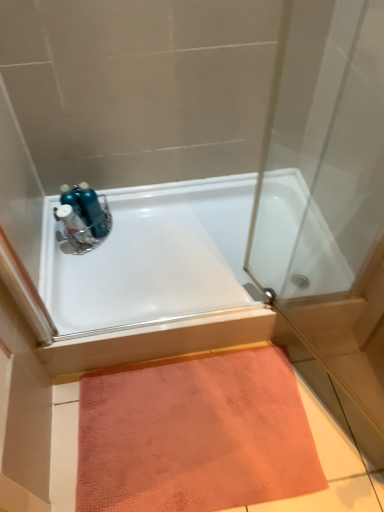
Describe the element at coordinates (152, 257) in the screenshot. The height and width of the screenshot is (512, 384). I see `white glossy bathtub at upper center` at that location.

This screenshot has height=512, width=384. Find the location of `white glossy bathtub at upper center`. white glossy bathtub at upper center is located at coordinates (152, 257).

Measure the distance between point (115, 487) and camera.

Point (115, 487) is 4.33 feet from camera.

What do you see at coordinates (91, 210) in the screenshot? I see `blue metallic bottles at upper left` at bounding box center [91, 210].

Find the location of `blue metallic bottles at upper left`. blue metallic bottles at upper left is located at coordinates (91, 210).

Locate an element on the screen. This screenshot has width=384, height=512. white glossy bathtub at upper center is located at coordinates (152, 257).

From the image's perspective, is metallic blue sink at upper left above white glossy bathtub at upper center?

Yes, from the image's perspective, metallic blue sink at upper left is above white glossy bathtub at upper center.

You are a GUI agent. You are given a task and a screenshot of the screen. Output one action in this format:
    pyautogui.click(x=<x>, y=<y>)
    Task: Click on the bathtub below the metallic blue sink at upper left (from the image's perspective)
    
    Given the screenshot: What is the action you would take?
    pyautogui.click(x=152, y=257)

Considering the relative sizes of metallic blue sink at upper left and white glossy bathtub at upper center in the image provided, is metallic blue sink at upper left thinner than white glossy bathtub at upper center?

Yes.

Which point is more forward, (106, 200) or (191, 228)?

The point (191, 228) is closer to the camera.

Is white glossy bathtub at upper center not inside metallic blue sink at upper left?

white glossy bathtub at upper center lies outside metallic blue sink at upper left's area.

What are the coordinates of `sink on the left of white glossy bathtub at upper center` in the screenshot? It's located at (83, 217).

How many degrees apart are the facing directions of white glossy bathtub at upper center and metallic blue sink at upper left?

There is a 1.5-degree angle between the facing directions of white glossy bathtub at upper center and metallic blue sink at upper left.

From a real-world perspective, is white glossy bathtub at upper center located beneath metallic blue sink at upper left?

Yes, from a real-world perspective, white glossy bathtub at upper center is beneath metallic blue sink at upper left.

From a real-world perspective, is white glossy bathtub at upper center physically located above or below orange textured mat at lower center?

Clearly, from a real-world perspective, white glossy bathtub at upper center is above orange textured mat at lower center.

Is white glossy bathtub at upper center thinner than orange textured mat at lower center?

No.

Between white glossy bathtub at upper center and orange textured mat at lower center, which one appears on the right side from the viewer's perspective?

Positioned to the right is orange textured mat at lower center.

From the image's perspective, is blue metallic bottles at upper left positioned above or below orange textured mat at lower center?

From the image's perspective, blue metallic bottles at upper left appears above orange textured mat at lower center.

Is blue metallic bottles at upper left turned away from orange textured mat at lower center?

No, blue metallic bottles at upper left's orientation is not away from orange textured mat at lower center.

Between blue metallic bottles at upper left and orange textured mat at lower center, which one appears on the left side from the viewer's perspective?

blue metallic bottles at upper left.

From a real-world perspective, which object stands above the other?

blue metallic bottles at upper left.

Considering the sizes of objects orange textured mat at lower center and metallic blue sink at upper left in the image provided, who is smaller, orange textured mat at lower center or metallic blue sink at upper left?

Smaller between the two is metallic blue sink at upper left.

Which object is more forward, orange textured mat at lower center or metallic blue sink at upper left?

orange textured mat at lower center is more forward.

Does orange textured mat at lower center have a lesser height compared to metallic blue sink at upper left?

Indeed, orange textured mat at lower center has a lesser height compared to metallic blue sink at upper left.

Where is `sink on the left of orange textured mat at lower center`? sink on the left of orange textured mat at lower center is located at coordinates (83, 217).

Is point (80, 200) positioned after point (285, 219)?

No.

Looking at this image, from a real-world perspective, between blue metallic bottles at upper left and white glossy bathtub at upper center, who is vertically lower?

white glossy bathtub at upper center.

Does blue metallic bottles at upper left appear on the left side of white glossy bathtub at upper center?

Yes, blue metallic bottles at upper left is to the left of white glossy bathtub at upper center.

Who is more distant, blue metallic bottles at upper left or white glossy bathtub at upper center?

blue metallic bottles at upper left is further from the camera.

Between point (86, 189) and point (93, 225), which one is positioned behind?

The point (86, 189) is farther from the camera.

Are blue metallic bottles at upper left and metallic blue sink at upper left far apart?

Actually, blue metallic bottles at upper left and metallic blue sink at upper left are a little close together.

Which object is closer to the camera, blue metallic bottles at upper left or metallic blue sink at upper left?

Positioned in front is metallic blue sink at upper left.

Identify the location of bathtub on the right of metallic blue sink at upper left. (152, 257).

At what (x,y) coordinates should I click in order to perform the action: click on sink positioned vertically above the white glossy bathtub at upper center (from a real-world perspective). Please return your answer as a coordinate pair (x, y). This screenshot has width=384, height=512. Looking at the image, I should click on (83, 217).

Considering their positions, is blue metallic bottles at upper left positioned closer to white glossy bathtub at upper center than orange textured mat at lower center?

The object closer to white glossy bathtub at upper center is blue metallic bottles at upper left.

When comparing their distances from orange textured mat at lower center, does metallic blue sink at upper left or blue metallic bottles at upper left seem closer?

metallic blue sink at upper left is positioned closer to the anchor orange textured mat at lower center.

Based on their spatial positions, is white glossy bathtub at upper center or metallic blue sink at upper left closer to orange textured mat at lower center?

white glossy bathtub at upper center lies closer to orange textured mat at lower center than the other object.

Considering their positions, is orange textured mat at lower center positioned further to white glossy bathtub at upper center than blue metallic bottles at upper left?

orange textured mat at lower center.

When comparing their distances from metallic blue sink at upper left, does blue metallic bottles at upper left or white glossy bathtub at upper center seem closer?

blue metallic bottles at upper left is closer to metallic blue sink at upper left.

When comparing their distances from metallic blue sink at upper left, does orange textured mat at lower center or blue metallic bottles at upper left seem closer?

The object closer to metallic blue sink at upper left is blue metallic bottles at upper left.

Which object lies nearer to the anchor point orange textured mat at lower center, blue metallic bottles at upper left or metallic blue sink at upper left?

The object closer to orange textured mat at lower center is metallic blue sink at upper left.

Which object lies further to the anchor point white glossy bathtub at upper center, blue metallic bottles at upper left or metallic blue sink at upper left?

Among the two, blue metallic bottles at upper left is located further to white glossy bathtub at upper center.

This screenshot has height=512, width=384. In order to click on bottle between metallic blue sink at upper left and white glossy bathtub at upper center in this screenshot , I will do `click(91, 210)`.

Locate an element on the screen. This screenshot has width=384, height=512. sink between blue metallic bottles at upper left and orange textured mat at lower center vertically is located at coordinates (83, 217).

Locate an element on the screen. The image size is (384, 512). bathtub that lies between metallic blue sink at upper left and orange textured mat at lower center from top to bottom is located at coordinates click(x=152, y=257).

This screenshot has height=512, width=384. Find the location of `bathtub between blue metallic bottles at upper left and orange textured mat at lower center vertically`. bathtub between blue metallic bottles at upper left and orange textured mat at lower center vertically is located at coordinates (152, 257).